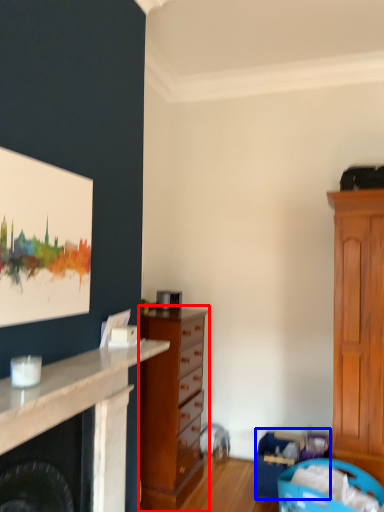
Question: Among these objects, which one is nearest to the camera, chest of drawers (highlighted by a red box) or laundry basket (highlighted by a blue box)?

Choices:
 (A) chest of drawers
 (B) laundry basket

Answer: (A)